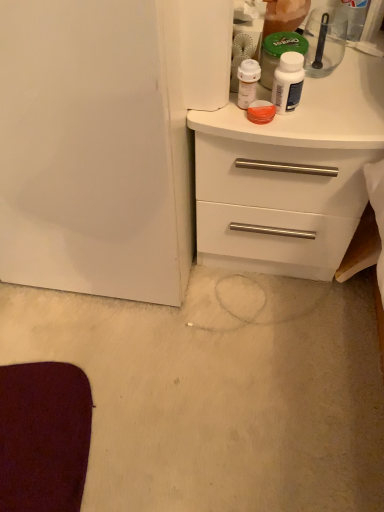
Question: In terms of height, does white matte chest of drawers at upper right look taller or shorter compared to white glossy bottle at upper right?

Choices:
 (A) short
 (B) tall

Answer: (B)

Question: Would you say white matte chest of drawers at upper right is inside or outside white glossy bottle at upper right?

Choices:
 (A) inside
 (B) outside

Answer: (B)

Question: Which object is positioned farthest from the white glossy bottle at upper right?

Choices:
 (A) white matte chest of drawers at upper right
 (B) transparent plastic spoon at upper right

Answer: (B)

Question: Considering the real-world distances, which object is farthest from the white glossy bottle at upper right?

Choices:
 (A) transparent plastic spoon at upper right
 (B) white matte chest of drawers at upper right

Answer: (A)